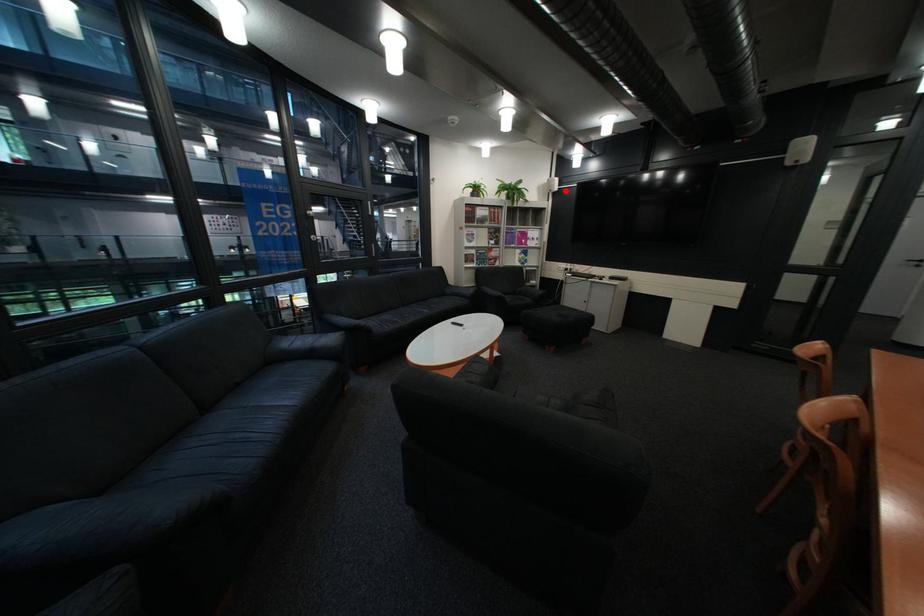
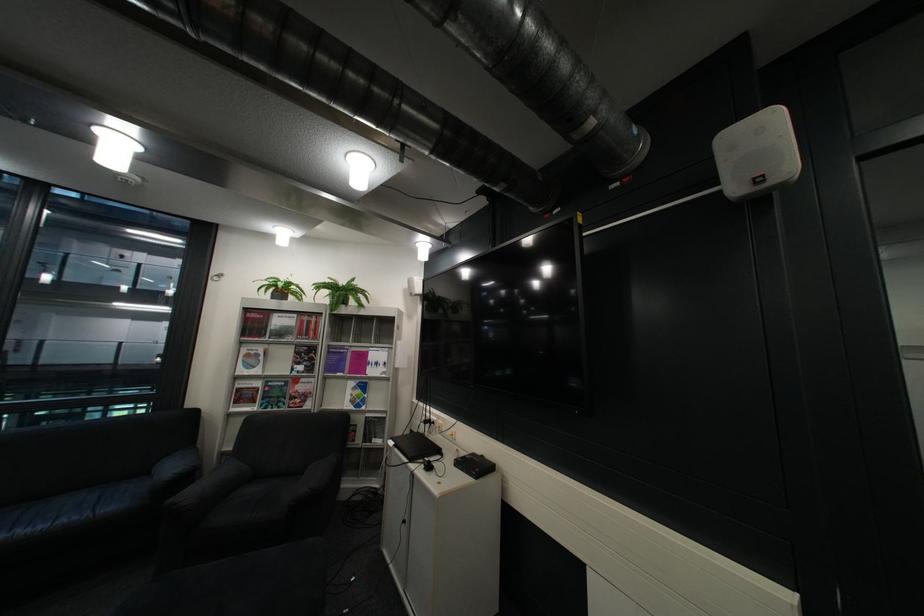
Question: A red point is marked in image1. In image2, is the corresponding 3D point closer to the camera or farther? Reply with the corresponding letter.

Choices:
 (A) The corresponding 3D point is closer.
 (B) The corresponding 3D point is farther.

Answer: (B)